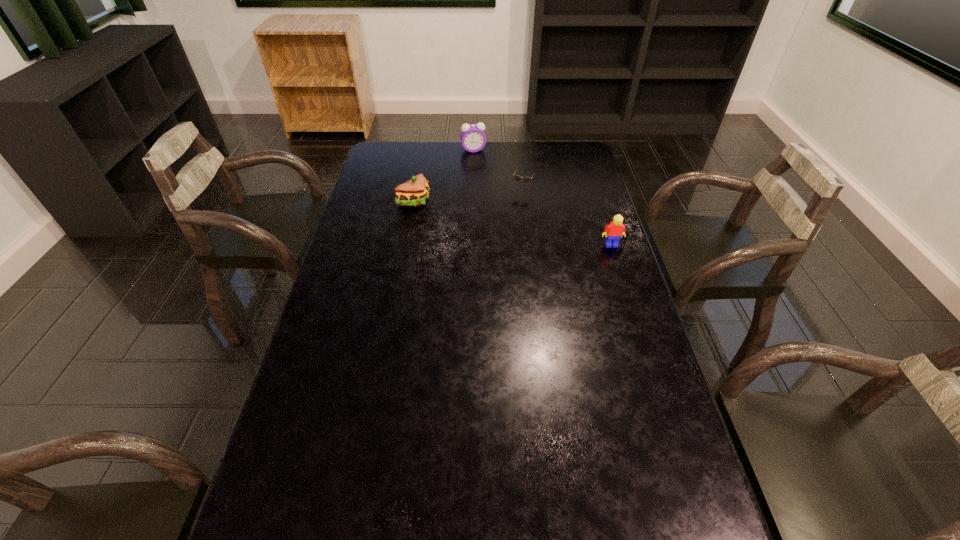
Locate an element on the screen. vacant space located 0.380m on the face of the alarm clock is located at coordinates click(490, 206).

This screenshot has width=960, height=540. Find the location of `free space located 0.200m on the face of the alarm clock`. free space located 0.200m on the face of the alarm clock is located at coordinates (483, 179).

Identify the location of free space located 0.050m in front of the lenses of the sunglasses. (511, 203).

Find the location of a particular element. This screenshot has width=960, height=540. blank area located in front of the lenses of the sunglasses is located at coordinates (494, 234).

Image resolution: width=960 pixels, height=540 pixels. What are the coordinates of `vacant space positioned in front of the lenses of the sunglasses` in the screenshot? It's located at (499, 225).

In order to click on object at the far edge in this screenshot , I will do `click(473, 138)`.

Locate an element on the screen. The width and height of the screenshot is (960, 540). object at the left edge is located at coordinates (414, 192).

This screenshot has height=540, width=960. I want to click on object that is at the right edge, so click(x=615, y=230).

I want to click on vacant region at the far edge of the desktop, so click(500, 150).

This screenshot has width=960, height=540. I want to click on vacant space at the left edge, so point(405,175).